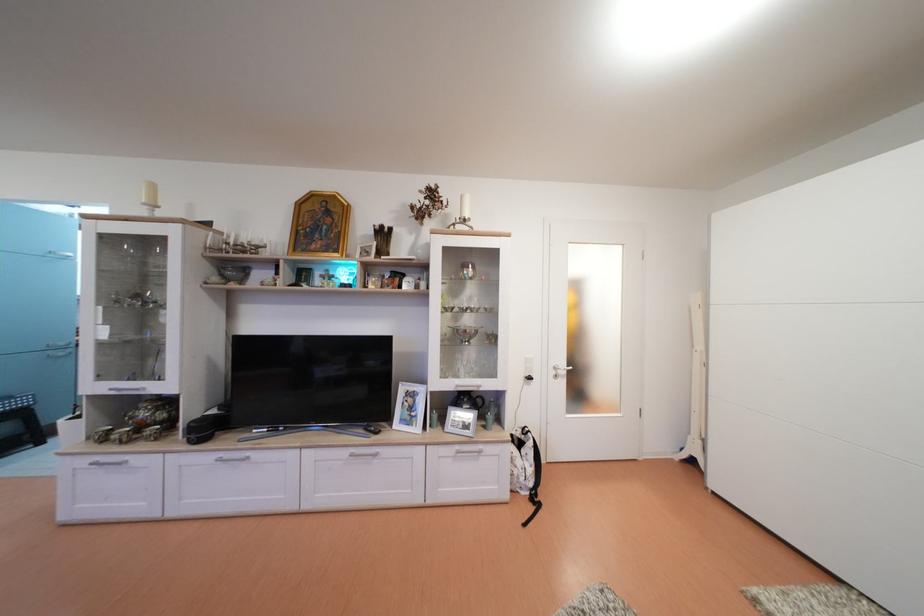
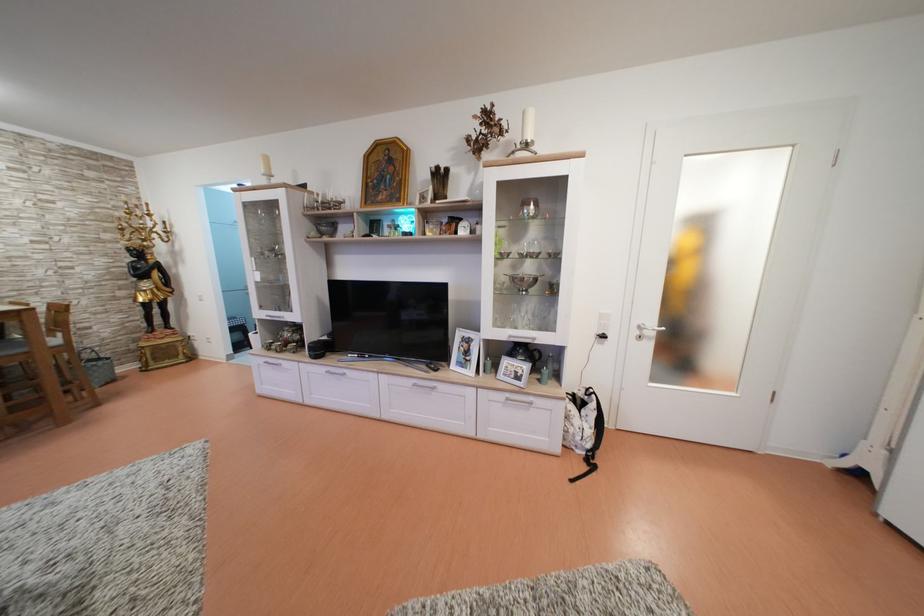
The point at (468, 201) is marked in the first image. Where is the corresponding point in the second image?

(530, 119)